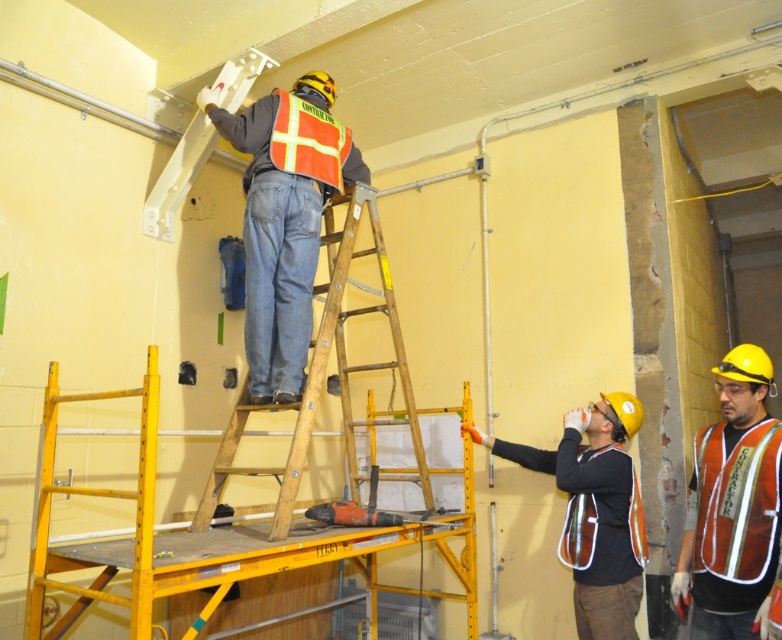
Which of these two, reflective orange vest at upper center or orange reflective vest at center, stands taller?

reflective orange vest at upper center

Who is more forward, (271, 106) or (766, 532)?

Point (766, 532) is in front.

Locate an element on the screen. Image resolution: width=782 pixels, height=640 pixels. reflective orange vest at upper center is located at coordinates (284, 220).

The height and width of the screenshot is (640, 782). Identify the location of wooden ladder at center. (325, 372).

Can you confirm if wooden ladder at center is positioned to the right of orange reflective safety vest at lower right?

In fact, wooden ladder at center is to the left of orange reflective safety vest at lower right.

Locate an element on the screen. wooden ladder at center is located at coordinates (325, 372).

Describe the element at coordinates (732, 506) in the screenshot. This screenshot has width=782, height=640. I see `orange reflective vest at center` at that location.

Between orange reflective vest at center and wooden ladder at center, which one is positioned higher?

wooden ladder at center is higher up.

Identify the location of orange reflective vest at center. The height and width of the screenshot is (640, 782). (732, 506).